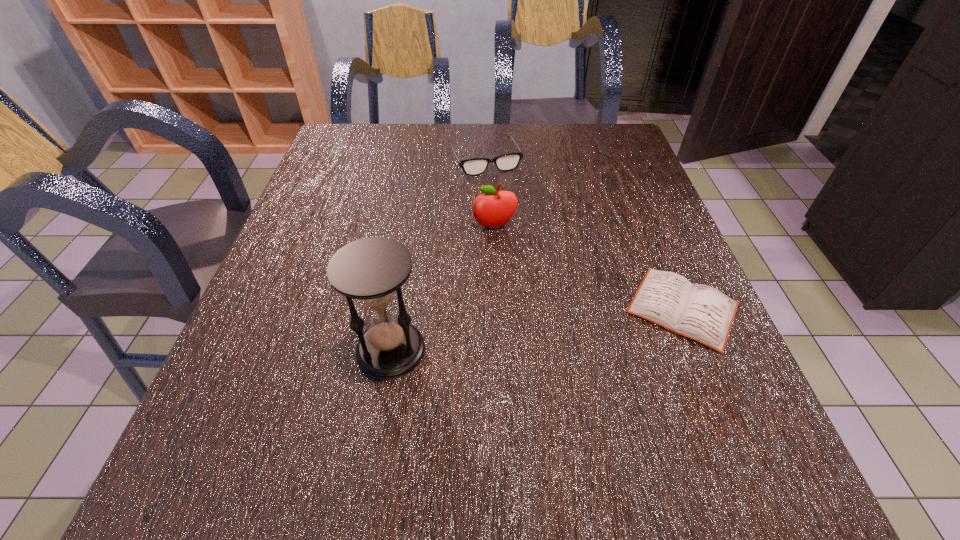
Locate an element on the screen. The width and height of the screenshot is (960, 540). free spot between the leftmost object and the farthest object is located at coordinates (438, 255).

This screenshot has width=960, height=540. I want to click on vacant space that's between the leftmost object and the apple, so click(443, 288).

Where is `vacant space that's between the leftmost object and the second farthest object`? This screenshot has height=540, width=960. vacant space that's between the leftmost object and the second farthest object is located at coordinates (443, 288).

This screenshot has height=540, width=960. I want to click on object that ranks as the closest to the rightmost object, so click(x=493, y=208).

Identify which object is the second nearest to the rightmost object. Please provide its 2D coordinates. Your answer should be formatted as a tuple, i.e. [(x, y)], where the tuple contains the x and y coordinates of a point satisfying the conditions above.

[(371, 270)]

At what (x,y) coordinates should I click in order to perform the action: click on blank space that satisfies the following two spatial constraints: 1. on the front side of the apple; 2. on the left side of the rightmost object. Please return your answer as a coordinate pair (x, y). Looking at the image, I should click on (497, 308).

The height and width of the screenshot is (540, 960). Find the location of `free space in the image that satisfies the following two spatial constraints: 1. on the back side of the leftmost object; 2. on the right side of the shortest object`. free space in the image that satisfies the following two spatial constraints: 1. on the back side of the leftmost object; 2. on the right side of the shortest object is located at coordinates (397, 308).

At what (x,y) coordinates should I click in order to perform the action: click on vacant space that satisfies the following two spatial constraints: 1. on the back side of the leftmost object; 2. on the left side of the third shortest object. Please return your answer as a coordinate pair (x, y). The width and height of the screenshot is (960, 540). Looking at the image, I should click on (412, 226).

Locate an element on the screen. free space that satisfies the following two spatial constraints: 1. on the front side of the apple; 2. on the left side of the diary is located at coordinates (497, 308).